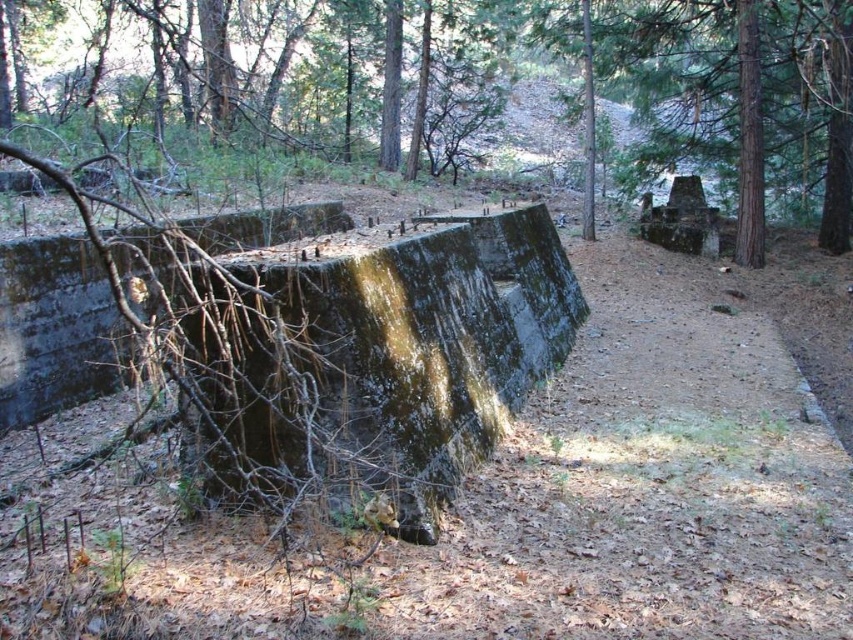
You are a hiker who wants to cross a stream that flows behind the green mossy concrete at center and the green mossy concrete wall at center. Which structure should you step on to avoid getting your shoes wet?

You should step on the green mossy concrete wall at center because it is thicker and less likely to be submerged by the stream compared to the thinner green mossy concrete at center.

You are a hiker trying to navigate through the forest. You see a green mossy concrete at center and a green mossy concrete wall at center. Which one is positioned more to the right side from your viewpoint?

The green mossy concrete at center is positioned more to the right side from your viewpoint compared to the green mossy concrete wall at center.

You are a hiker who wants to cross the green mossy concrete at center and the green mossy concrete wall at center. Which one is shorter and easier to step over?

The green mossy concrete at center is not as tall as the green mossy concrete wall at center, so it is shorter and easier to step over.